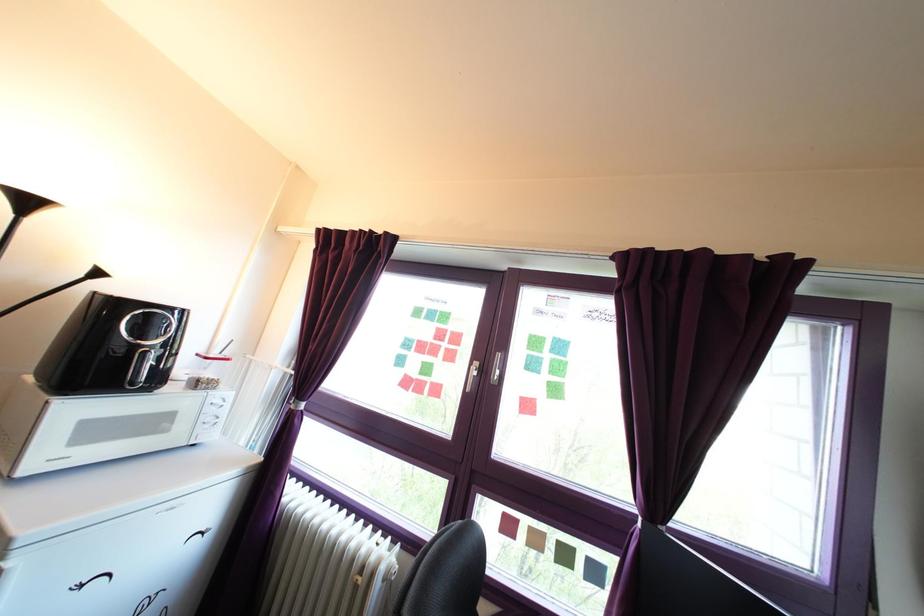
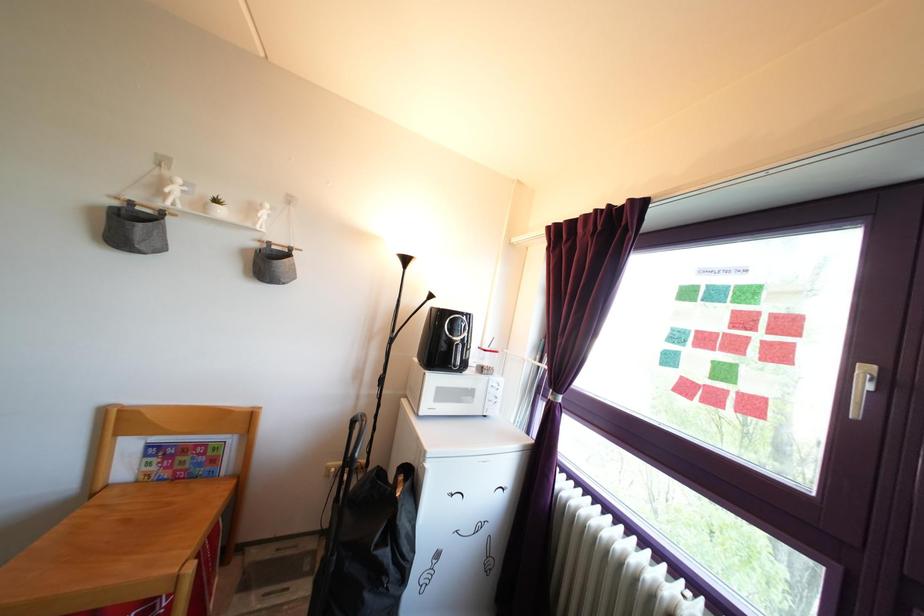
Find the pixel in the second image that matches pixel 421 395 in the first image.

(715, 407)